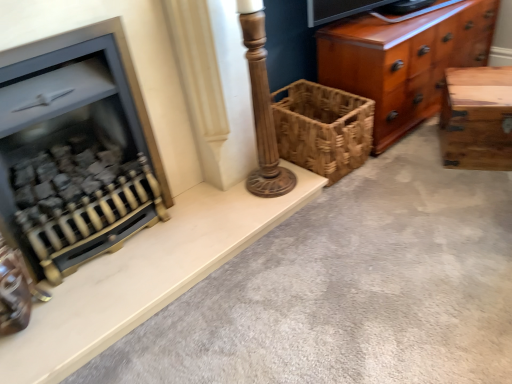
At what (x,y) coordinates should I click in order to perform the action: click on space that is in front of woven brown basket at center. Please return your answer as a coordinate pair (x, y). Looking at the image, I should click on (357, 198).